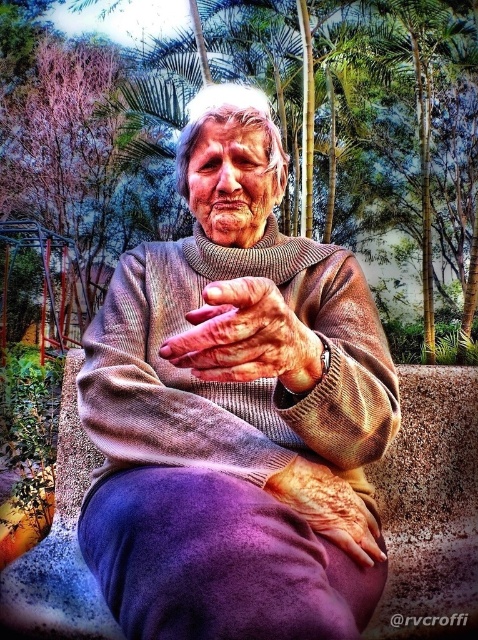
Question: Which object appears closest to the camera in this image?

Choices:
 (A) knitted sweater at center
 (B) leather-like skin at center
 (C) dry skin at center
 (D) green leafy tree at center

Answer: (A)

Question: Is knitted sweater at center smaller than dry skin at center?

Choices:
 (A) yes
 (B) no

Answer: (B)

Question: In this image, where is knitted sweater at center located relative to purple soft fabric at center?

Choices:
 (A) above
 (B) below

Answer: (A)

Question: Estimate the real-world distances between objects in this image. Which object is closer to the knitted sweater at center?

Choices:
 (A) dry skin at center
 (B) green leafy tree at center
 (C) purple soft fabric at center
 (D) leather-like skin at center

Answer: (C)

Question: Which point is closer to the camera?

Choices:
 (A) (249, 19)
 (B) (325, 637)
 (C) (302, 480)

Answer: (B)

Question: Can you confirm if knitted sweater at center is positioned to the right of dry skin at center?

Choices:
 (A) no
 (B) yes

Answer: (A)